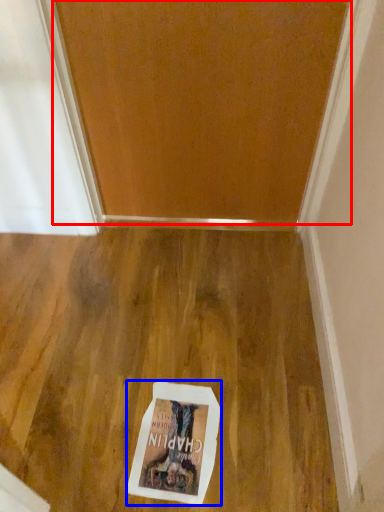
Question: Which object appears closest to the camera in this image, door (highlighted by a red box) or postcard (highlighted by a blue box)?

Choices:
 (A) door
 (B) postcard

Answer: (A)